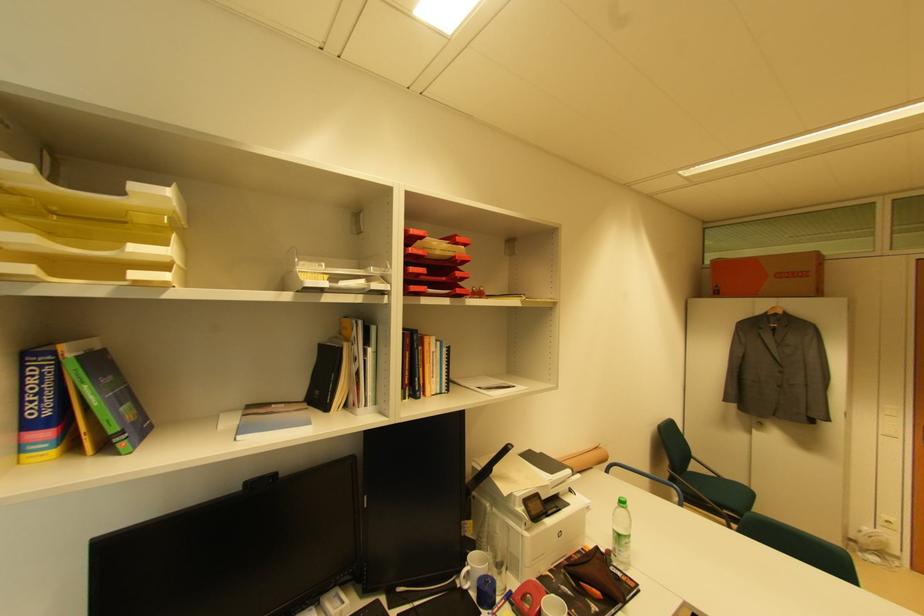
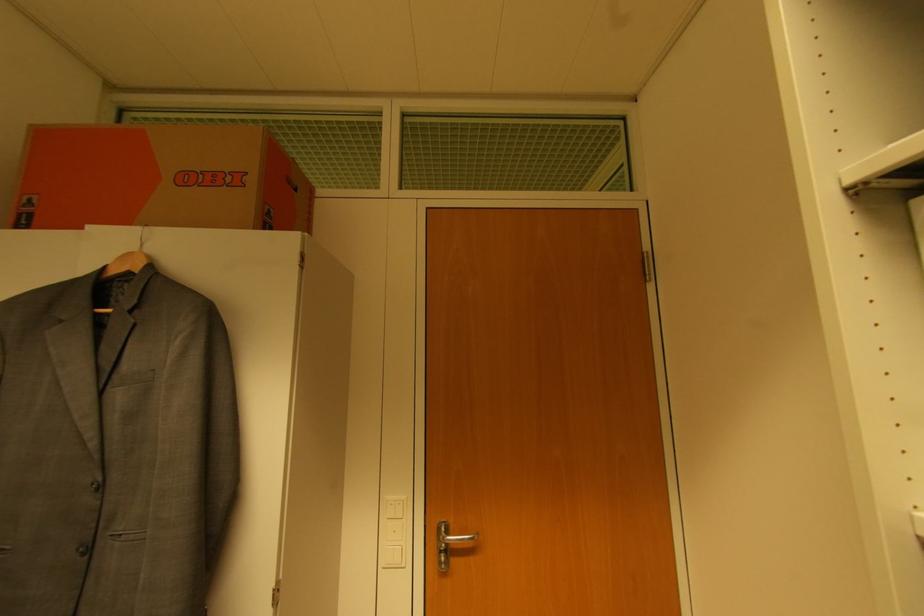
Where in the second image is the point corresponding to the point at 720,293 from the first image?

(32, 217)